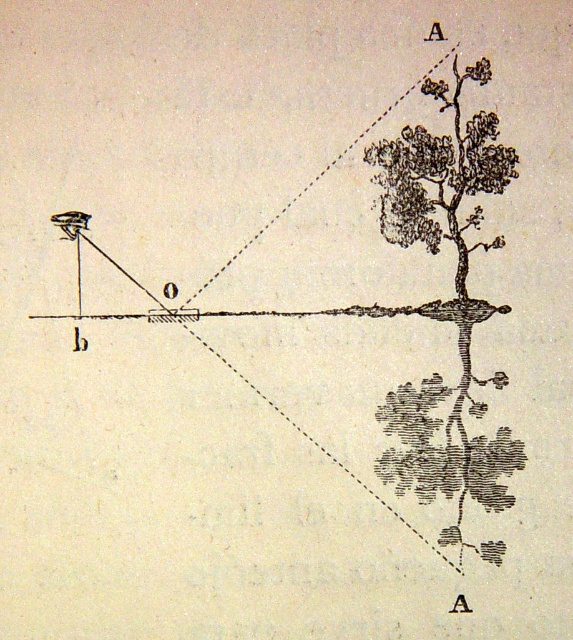
Is black textured tree at right above black textured tree at upper right?

Actually, black textured tree at right is below black textured tree at upper right.

Can you confirm if black textured tree at right is positioned to the right of black textured tree at upper right?

Yes, black textured tree at right is to the right of black textured tree at upper right.

The height and width of the screenshot is (640, 573). What do you see at coordinates (452, 298) in the screenshot?
I see `black textured tree at right` at bounding box center [452, 298].

Locate an element on the screen. black textured tree at right is located at coordinates pos(452,298).

Does black textured tree at upper right appear over matte black rectangle at center?

Yes, black textured tree at upper right is above matte black rectangle at center.

Between black textured tree at upper right and matte black rectangle at center, which one is positioned lower?

Positioned lower is matte black rectangle at center.

What do you see at coordinates (441, 173) in the screenshot? This screenshot has width=573, height=640. I see `black textured tree at upper right` at bounding box center [441, 173].

This screenshot has width=573, height=640. In order to click on black textured tree at upper right in this screenshot , I will do `click(441, 173)`.

Can you confirm if black textured tree at right is bigger than matte black rectangle at center?

Actually, black textured tree at right might be smaller than matte black rectangle at center.

Where is `black textured tree at right`? black textured tree at right is located at coordinates (452, 298).

Image resolution: width=573 pixels, height=640 pixels. I want to click on black textured tree at right, so click(x=452, y=298).